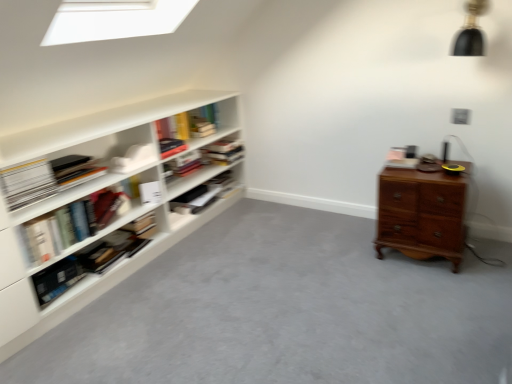
Image resolution: width=512 pixels, height=384 pixels. I want to click on blank space situated above wooden chest of drawers at right (from a real-world perspective), so click(424, 164).